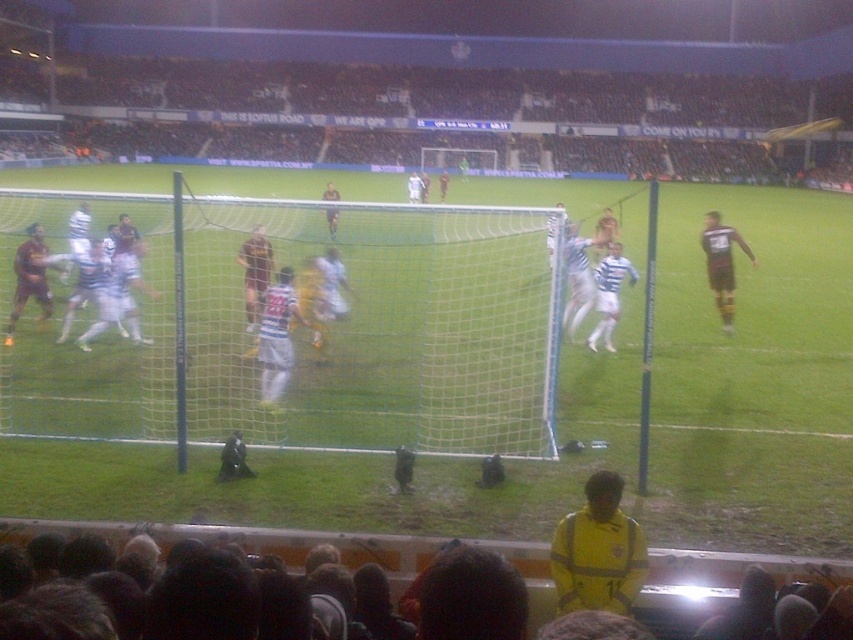
Based on the photo, you are a soccer coach analyzing the match. You notice two players in the image, one with dark hair at lower center and another wearing a white matte jersey at center. Which player is shorter in height?

The dark hair at lower center is shorter in height compared to the white matte jersey at center.

You are a soccer coach analyzing the game. You notice the yellow jersey at lower center and the dark brown jersey at left. Which player is closer to the goalpost in the foreground?

The yellow jersey at lower center is closer to the goalpost in the foreground because it is in front of the dark brown jersey at left.

You are a soccer player wearing a yellow jersey at lower center and need to pass the ball to your teammate in the dark brown jersey at left. The field is slippery due to recent rain. Considering the distance between you and your teammate, what is the safest way to ensure the ball reaches them accurately?

The yellow jersey at lower center is 8.84 meters away from the dark brown jersey at left. To ensure accuracy on the slippery field, a short, controlled pass with the inside of the foot would be safest, keeping the ball low and within the 8.84 meter distance to avoid losing control.